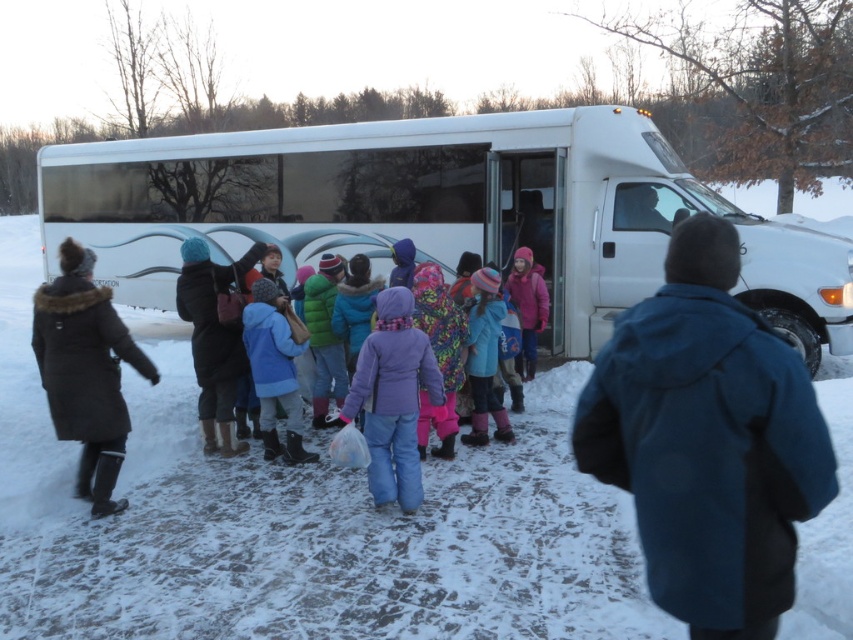
Is point (436, 269) closer to camera compared to point (532, 352)?

Yes, it is in front of point (532, 352).

Who is higher up, fluffy pink snow pants at center or pink fleece jacket at center?

pink fleece jacket at center

Find the location of `fluffy pink snow pants at center`. fluffy pink snow pants at center is located at coordinates (439, 355).

Can you confirm if purple fleece jacket at center is thinner than multicolored knitted hat at center?

No.

Is point (370, 486) in front of point (474, 348)?

Yes, it is.

Identify the location of purple fleece jacket at center. This screenshot has width=853, height=640. (393, 397).

Who is taller, blue fleece jacket at center or pink fleece jacket at center?

blue fleece jacket at center

Is blue fleece jacket at center shorter than pink fleece jacket at center?

In fact, blue fleece jacket at center may be taller than pink fleece jacket at center.

Who is more forward, (245,333) or (523,352)?

Point (245,333) is in front.

Image resolution: width=853 pixels, height=640 pixels. Identify the location of blue fleece jacket at center. (274, 369).